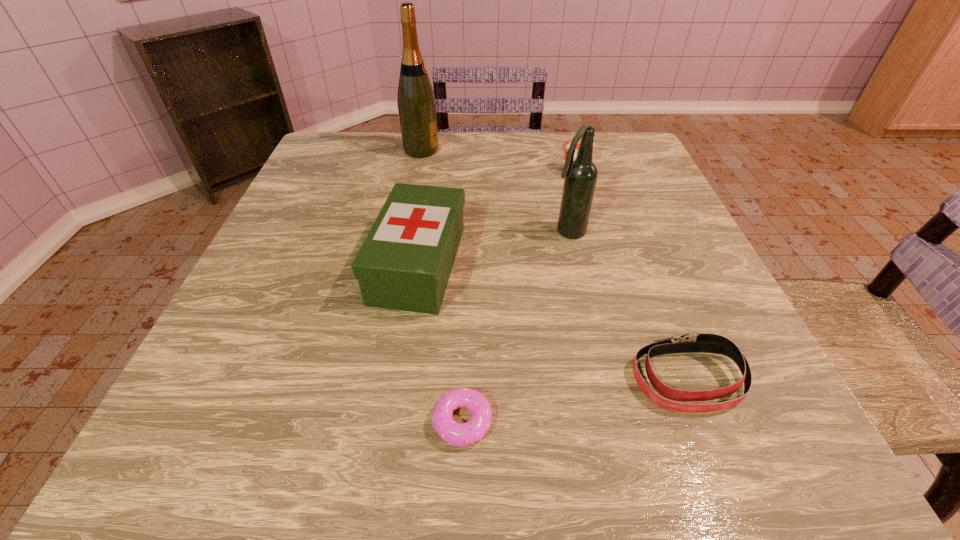
You are a GUI agent. You are given a task and a screenshot of the screen. Output one action in this format:
    pyautogui.click(x=<x>, y=<y>)
    Task: Click on the vacant space located 0.400m on the clock face of the fifth nearest object
    
    Given the screenshot: What is the action you would take?
    pyautogui.click(x=611, y=286)

Find the location of a particular element. This screenshot has width=960, height=540. vacant area situated on the back of the dog collar is located at coordinates (624, 215).

Locate an element on the screen. The height and width of the screenshot is (540, 960). free space located 0.360m on the back of the shortest object is located at coordinates (468, 240).

Find the location of `wine bottle located at the far edge`. wine bottle located at the far edge is located at coordinates (416, 102).

You are a GUI agent. You are given a task and a screenshot of the screen. Output one action in this format:
    pyautogui.click(x=<x>, y=<y>)
    Task: Click on the alarm clock present at the far edge
    Image resolution: width=960 pixels, height=540 pixels.
    Given the screenshot: What is the action you would take?
    pyautogui.click(x=566, y=144)

Identify the location of dog collar that is at the near edge. The image size is (960, 540). (690, 342).

This screenshot has height=540, width=960. I want to click on doughnut positioned at the near edge, so click(x=456, y=434).

Identify the location of alarm clock that is positioned at the right edge. Image resolution: width=960 pixels, height=540 pixels. (566, 144).

Where is `dog collar located in the right edge section of the desktop`? Image resolution: width=960 pixels, height=540 pixels. dog collar located in the right edge section of the desktop is located at coordinates (690, 342).

The height and width of the screenshot is (540, 960). I want to click on object at the far right corner, so click(566, 144).